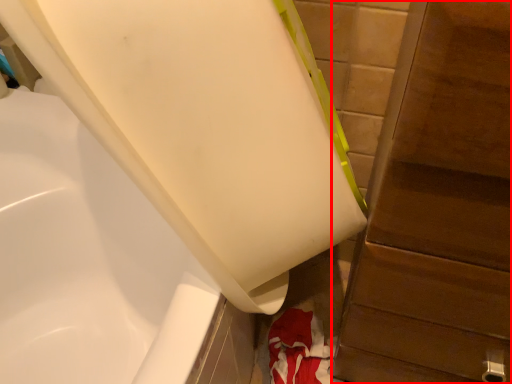
Question: From the image's perspective, what is the correct spatial positioning of dresser (annotated by the red box) in reference to bathtub?

Choices:
 (A) above
 (B) below

Answer: (B)